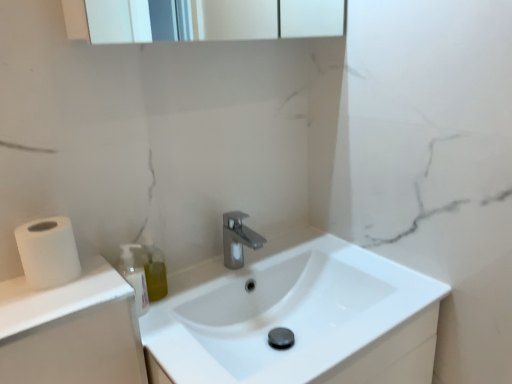
Question: Does white glossy sink at center touch satin nickel faucet at center?

Choices:
 (A) no
 (B) yes

Answer: (A)

Question: From a real-world perspective, is white glossy sink at center beneath satin nickel faucet at center?

Choices:
 (A) yes
 (B) no

Answer: (A)

Question: From the image's perspective, is white glossy sink at center over satin nickel faucet at center?

Choices:
 (A) no
 (B) yes

Answer: (A)

Question: Is white glossy sink at center closer to camera compared to satin nickel faucet at center?

Choices:
 (A) yes
 (B) no

Answer: (A)

Question: Is satin nickel faucet at center completely or partially inside white glossy sink at center?

Choices:
 (A) yes
 (B) no

Answer: (B)

Question: Looking at the image, does translucent plastic soap dispenser at left seem bigger or smaller compared to white matte toilet paper at left?

Choices:
 (A) big
 (B) small

Answer: (B)

Question: Is translucent plastic soap dispenser at left wider or thinner than white matte toilet paper at left?

Choices:
 (A) wide
 (B) thin

Answer: (B)

Question: From a real-world perspective, is translucent plastic soap dispenser at left positioned above or below white matte toilet paper at left?

Choices:
 (A) below
 (B) above

Answer: (A)

Question: Considering the positions of point (146, 296) and point (40, 259), is point (146, 296) closer or farther from the camera than point (40, 259)?

Choices:
 (A) closer
 (B) farther

Answer: (B)

Question: From the image's perspective, is white matte toilet paper at left above or below white glossy sink at center?

Choices:
 (A) below
 (B) above

Answer: (B)

Question: In terms of width, does white matte toilet paper at left look wider or thinner when compared to white glossy sink at center?

Choices:
 (A) thin
 (B) wide

Answer: (A)

Question: Considering the positions of point (35, 238) and point (282, 258), is point (35, 238) closer or farther from the camera than point (282, 258)?

Choices:
 (A) closer
 (B) farther

Answer: (A)

Question: From a real-world perspective, is white matte toilet paper at left above or below white glossy sink at center?

Choices:
 (A) above
 (B) below

Answer: (A)

Question: Considering the positions of translucent plastic soap dispenser at left and satin nickel faucet at center in the image, is translucent plastic soap dispenser at left bigger or smaller than satin nickel faucet at center?

Choices:
 (A) big
 (B) small

Answer: (B)

Question: Considering the positions of translucent plastic soap dispenser at left and satin nickel faucet at center in the image, is translucent plastic soap dispenser at left taller or shorter than satin nickel faucet at center?

Choices:
 (A) tall
 (B) short

Answer: (A)